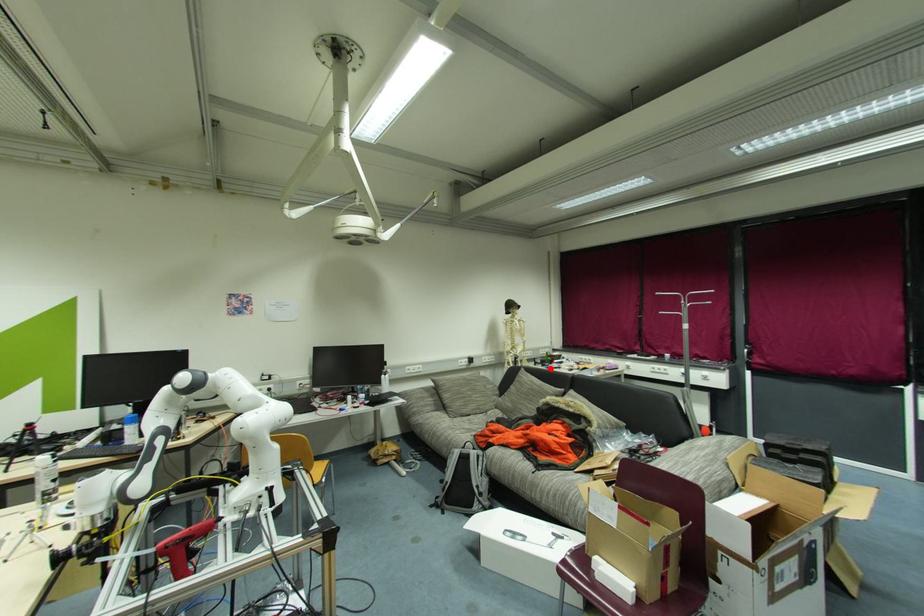
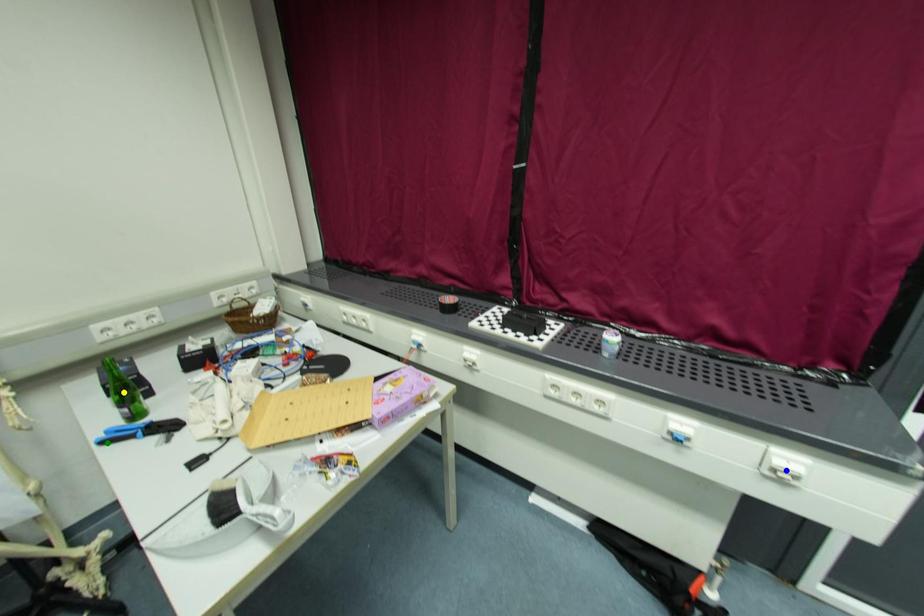
Question: I am providing you with two images of the same scene from different viewpoints. A red point is marked on the first image. You are given multiple points on the second image. Which point in image 2 is actually the same real-world point as the red point in image 1?

Choices:
 (A) yellow point
 (B) green point
 (C) blue point

Answer: (B)